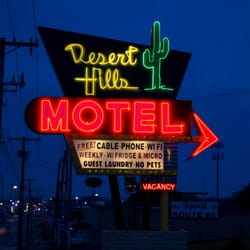
Where is `neon sign`? neon sign is located at coordinates point(127,98).